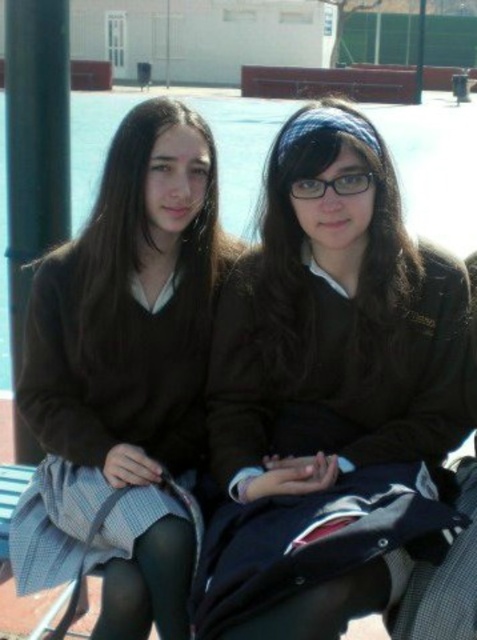
You are a photographer taking a picture of the matte brown sweater at left and the transparent plastic glasses at center. Which object should you focus on first if you want to capture both in focus, considering their positions?

The matte brown sweater at left is below transparent plastic glasses at center, so you should focus on the transparent plastic glasses at center first since it is closer to the camera.

You are a photographer standing in front of the scene. You want to take a picture of the matte brown sweater at left and the black metal pole at left. How far apart are these two objects in inches?

The matte brown sweater at left is 33.14 inches away from the black metal pole at left.

Consider the image. You are standing in a park and see two people sitting on a bench. You have a camera with a zoom lens that can focus on objects within a 0.3 radius around point coordinates. You want to take a photo of the matte brown sweater at left. What is the minimum distance you need to move your camera to ensure it is within the focus range?

The matte brown sweater at left is located at coordinates point (124, 374). To ensure it falls within the camera focus range of 0.3 radius, you need to position the camera so that the distance between the sweater and the camera center is less than or equal to 0.3. The minimum distance you need to move depends on your current position, but the target coordinates are (124, 374) with a 0.3 radius around it.